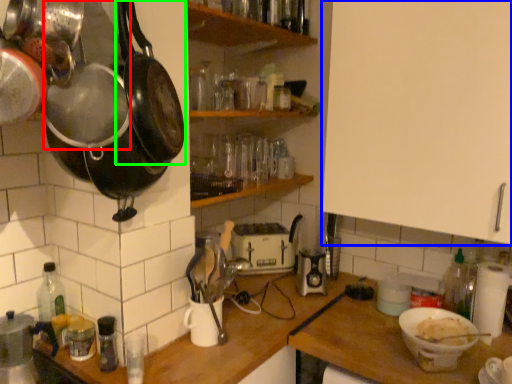
Question: Which object is the farthest from frying pan (highlighted by a red box)? Choose among these: cabinetry (highlighted by a blue box) or frying pan (highlighted by a green box).

Choices:
 (A) cabinetry
 (B) frying pan

Answer: (A)